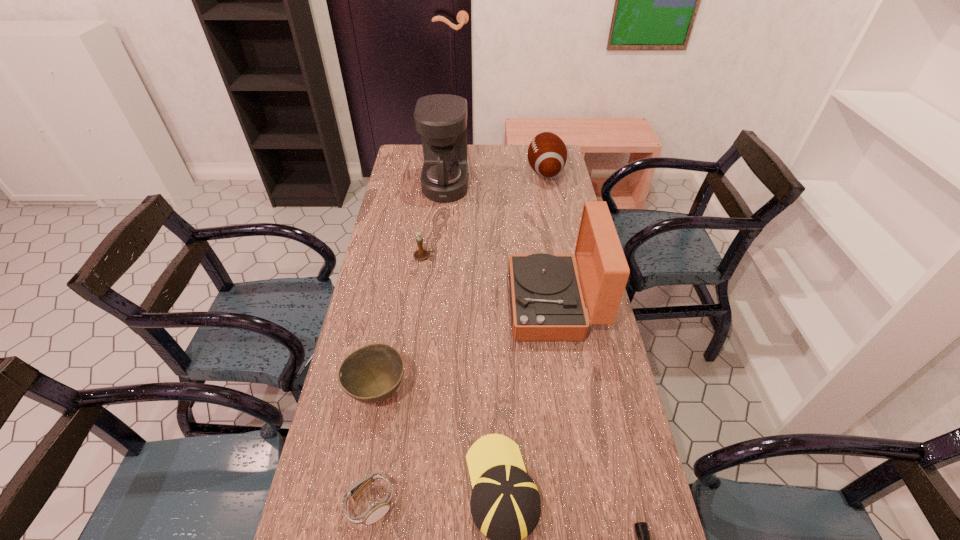
The width and height of the screenshot is (960, 540). In order to click on candle holder that is at the left edge in this screenshot , I will do `click(420, 254)`.

Identify the location of bowl that is at the left edge. (372, 373).

This screenshot has width=960, height=540. In order to click on watch positioned at the left edge in this screenshot , I will do `click(377, 510)`.

The image size is (960, 540). Find the location of `phonograph record that is positioned at the right edge`. phonograph record that is positioned at the right edge is located at coordinates (547, 304).

You are a GUI agent. You are given a task and a screenshot of the screen. Output one action in this format:
    pyautogui.click(x=<x>, y=<y>)
    Task: Click on the football present at the right edge
    The image size is (960, 540).
    Given the screenshot: What is the action you would take?
    pyautogui.click(x=547, y=154)

Image resolution: width=960 pixels, height=540 pixels. In order to click on object positioned at the far left corner in this screenshot , I will do `click(441, 119)`.

You are a GUI agent. You are given a task and a screenshot of the screen. Output one action in this format:
    pyautogui.click(x=<x>, y=<y>)
    Task: Click on the object that is at the far right corner
    This screenshot has height=540, width=960.
    Given the screenshot: What is the action you would take?
    coord(547,154)

The height and width of the screenshot is (540, 960). I want to click on free spot at the left edge of the desktop, so click(x=354, y=326).

In the image, there is a desktop. Identify the location of vacant region at the right edge. Image resolution: width=960 pixels, height=540 pixels. (624, 400).

You are a GUI agent. You are given a task and a screenshot of the screen. Output one action in this format:
    pyautogui.click(x=<x>, y=<y>)
    Task: Click on the unoccupied area between the fourth nearest object and the coffee maker
    This screenshot has height=540, width=960.
    Given the screenshot: What is the action you would take?
    pyautogui.click(x=412, y=288)